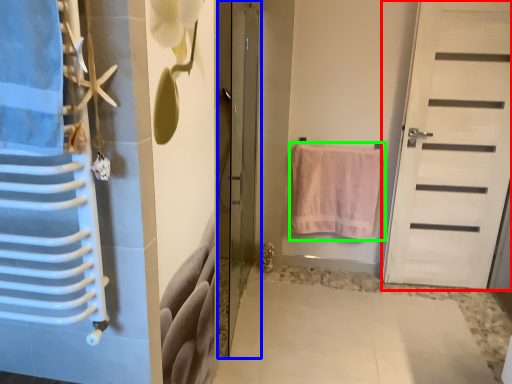
Question: Which object is positioned closest to door (highlighted by a red box)? Select from door (highlighted by a blue box) and towel (highlighted by a green box).

Choices:
 (A) door
 (B) towel

Answer: (B)